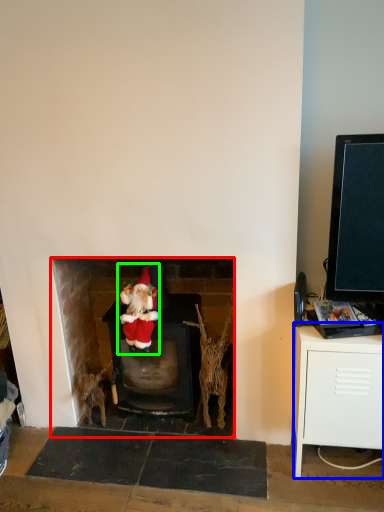
Question: Which is farther away from fireplace (highlighted by a red box)? table (highlighted by a blue box) or person (highlighted by a green box)?

Choices:
 (A) table
 (B) person

Answer: (A)